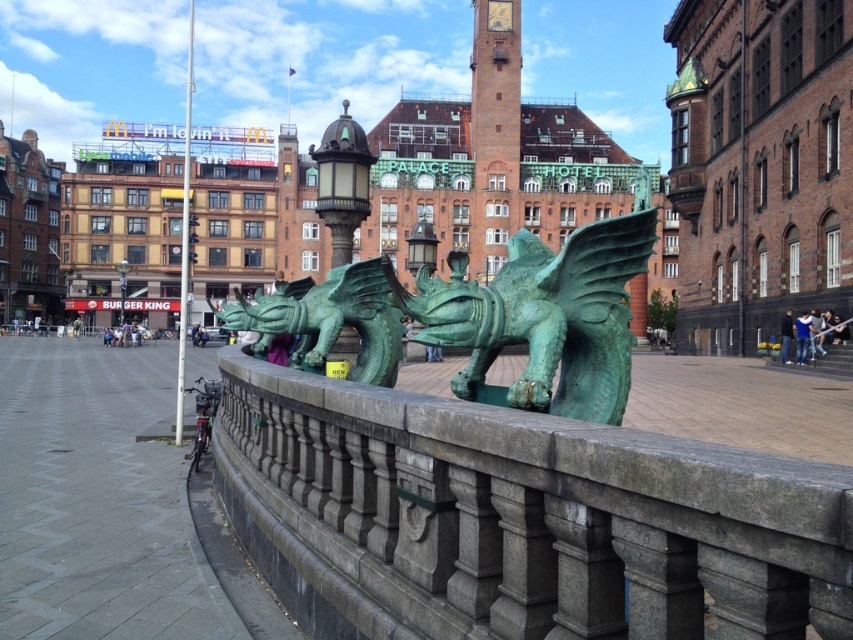
You are standing in the urban square and want to take a photo of both the green patina stone dragon at center and the green patina dragon at center. Which dragon should you position closer to the camera to include both in the frame?

You should position the green patina stone dragon at center closer to the camera because it is already in front of the green patina dragon at center, so adjusting its position will help both fit into the frame.

You are standing at the center of the paved square and want to find the green stone railing at center. Based on the 2D coordinates provided, in which direction should you walk to reach it?

The green stone railing at center is located at coordinates 0.812 on the x axis and 0.610 on the y axis. Since you are at the center of the square, which is at coordinates (426, 320), you should walk northeast to reach the green stone railing at center.